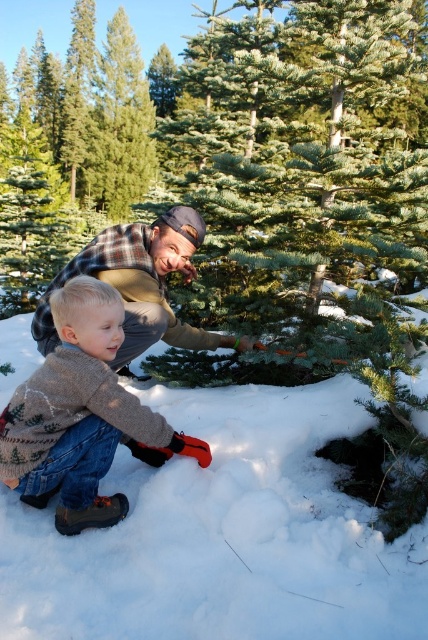
You are standing in the snowy forest and want to place a 2 meter long wooden ladder against the green matte christmas tree at center. Is the ladder long enough to reach the top of the tree?

The green matte christmas tree at center is 1.85 meters from viewer, so the 2 meter long wooden ladder is long enough to reach the top of the tree.

You are standing in the snowy forest and see two points marked in the scene. The first point is at coordinates point (256,211) and the second is at point (148,323). Which point is closer to you?

Point (256,211) is closer to you because it is further to the viewer than point (148,323).